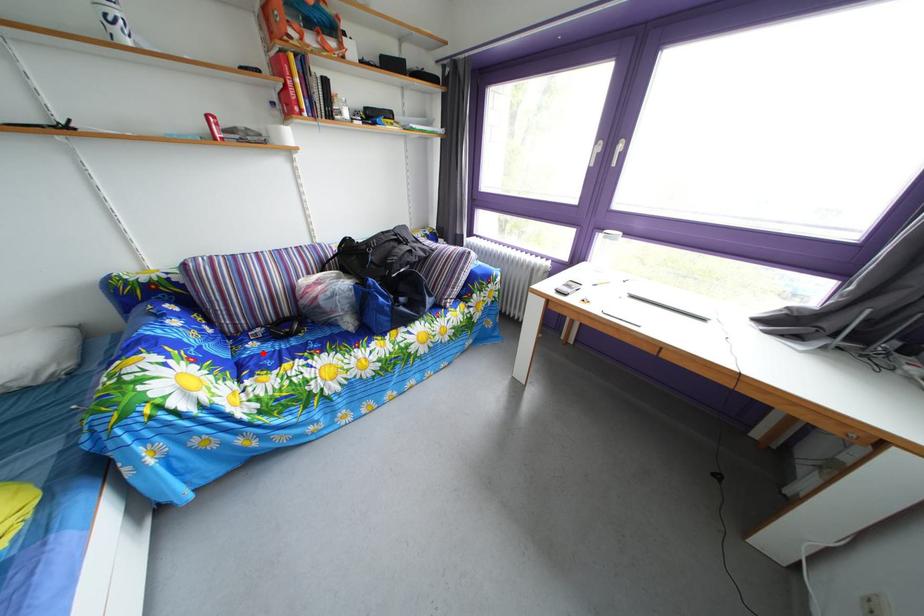
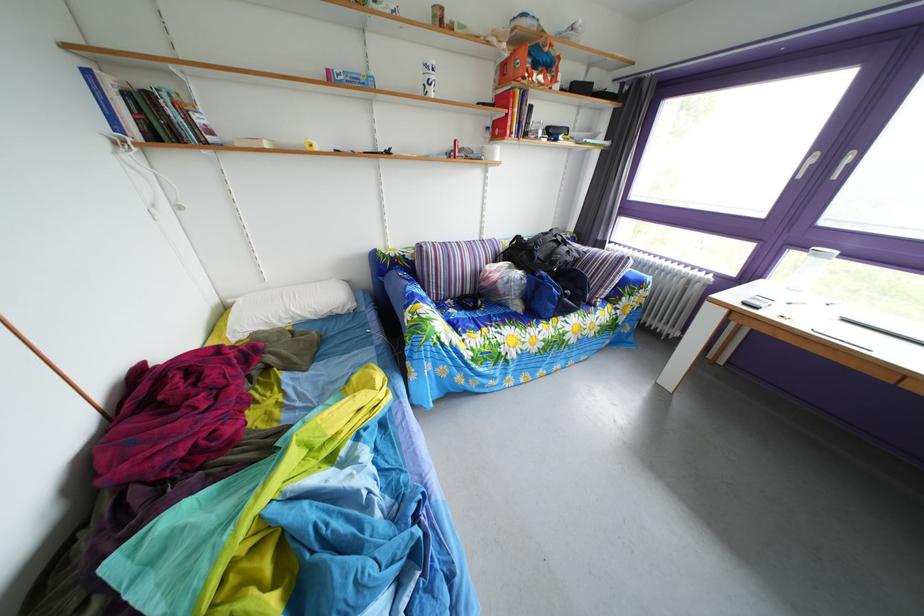
Find the pixel in the second image that matches the highlighted location in the first image.

(463, 320)